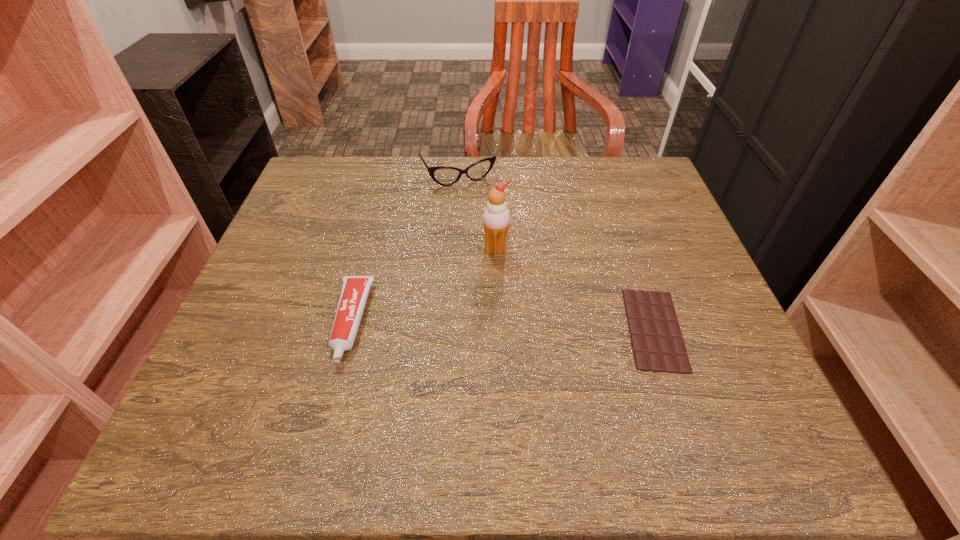
Find the location of a particular element. The width and height of the screenshot is (960, 540). vacant position located 0.150m at the front with a straw on the icecream is located at coordinates (524, 310).

Image resolution: width=960 pixels, height=540 pixels. I want to click on vacant region located at the front with a straw on the icecream, so click(538, 339).

The image size is (960, 540). I want to click on vacant region located on the front-facing side of the second tallest object, so click(514, 271).

Identify the location of vacant space situated on the front-facing side of the second tallest object. This screenshot has width=960, height=540. tap(497, 241).

At what (x,y) coordinates should I click in order to perform the action: click on vacant space located 0.170m on the front-facing side of the second tallest object. Please return your answer as a coordinate pair (x, y). Looking at the image, I should click on (492, 230).

Identify the location of object positioned at the far edge. coord(443,175).

Where is `toothpaste that is at the near edge`? The image size is (960, 540). toothpaste that is at the near edge is located at coordinates (355, 289).

Identify the location of chocolate bar located at the near edge. The image size is (960, 540). (658, 346).

At what (x,y) coordinates should I click in order to perform the action: click on object that is positioned at the right edge. Please return your answer as a coordinate pair (x, y). This screenshot has height=540, width=960. Looking at the image, I should click on (658, 346).

Where is `object that is at the near right corner`? Image resolution: width=960 pixels, height=540 pixels. object that is at the near right corner is located at coordinates (658, 346).